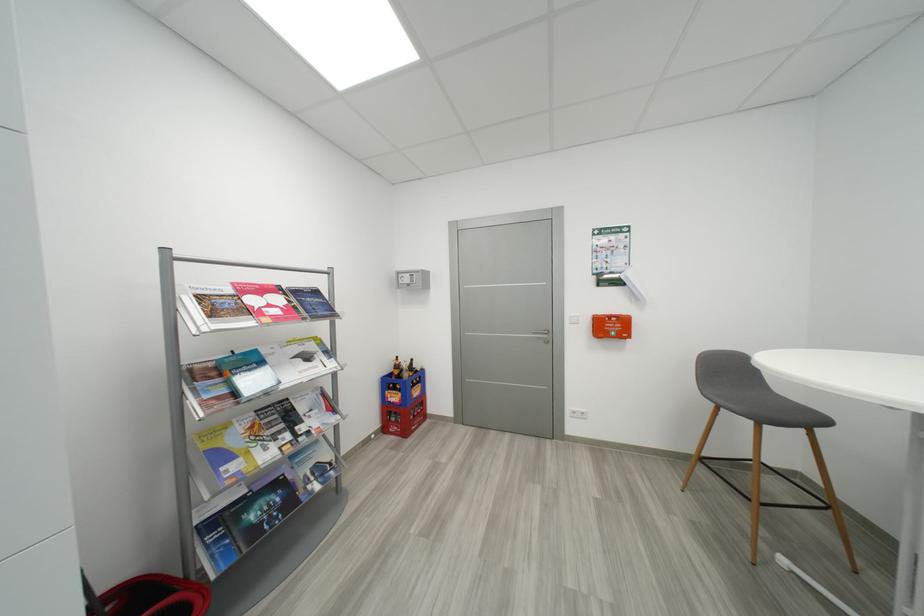
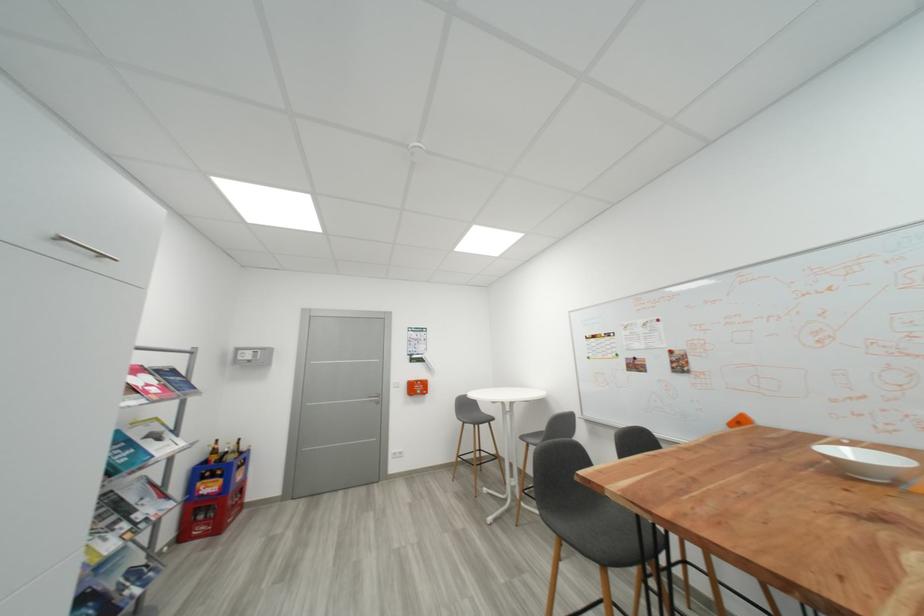
Find the pixel in the second image that matches point (408, 371) in the first image.

(234, 454)